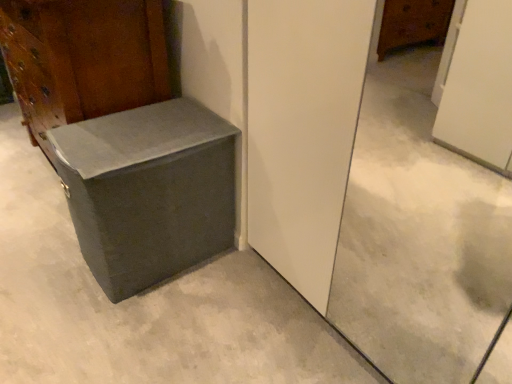
Describe the element at coordinates (148, 191) in the screenshot. I see `matte gray cardboard box at lower left` at that location.

Image resolution: width=512 pixels, height=384 pixels. What do you see at coordinates (143, 305) in the screenshot? I see `gray concrete at center` at bounding box center [143, 305].

Identify the location of matte gray cardboard box at lower left. tap(148, 191).

From a real-world perspective, relative to gray concrete at center, is matte gray cardboard box at lower left vertically above or below?

matte gray cardboard box at lower left is situated higher than gray concrete at center in the real world.

Considering the relative positions of matte gray cardboard box at lower left and gray concrete at center in the image provided, is matte gray cardboard box at lower left to the right of gray concrete at center from the viewer's perspective?

Correct, you'll find matte gray cardboard box at lower left to the right of gray concrete at center.

From the image's perspective, is matte gray cardboard box at lower left under gray concrete at center?

No, from the image's perspective, matte gray cardboard box at lower left is not beneath gray concrete at center.

Is matte gray cardboard box at lower left situated inside gray concrete at center or outside?

matte gray cardboard box at lower left cannot be found inside gray concrete at center.

The image size is (512, 384). I want to click on furniture that appears above the matte gray cardboard box at lower left (from a real-world perspective), so click(x=83, y=59).

What's the angular difference between matte gray trunk at lower left and matte gray cardboard box at lower left's facing directions?

There is a 0.226-degree angle between the facing directions of matte gray trunk at lower left and matte gray cardboard box at lower left.

Is matte gray trunk at lower left closer to the viewer compared to matte gray cardboard box at lower left?

No.

Could you tell me if matte gray trunk at lower left is facing gray concrete at center?

No, matte gray trunk at lower left is not facing towards gray concrete at center.

In terms of height, does matte gray trunk at lower left look taller or shorter compared to gray concrete at center?

In the image, matte gray trunk at lower left appears to be taller than gray concrete at center.

Is matte gray trunk at lower left surrounding gray concrete at center?

Definitely not — gray concrete at center is not inside matte gray trunk at lower left.

Which is nearer, (19,104) or (18,125)?

The point (18,125) is in front.

The image size is (512, 384). Find the location of `furniture above the matte gray cardboard box at lower left (from the image's perspective)`. furniture above the matte gray cardboard box at lower left (from the image's perspective) is located at coordinates (83, 59).

Between matte gray cardboard box at lower left and matte gray trunk at lower left, which one has smaller size?

matte gray cardboard box at lower left.

Which object is positioned more to the right, matte gray cardboard box at lower left or matte gray trunk at lower left?

Positioned to the right is matte gray cardboard box at lower left.

Is matte gray trunk at lower left surrounded by matte gray cardboard box at lower left?

No, matte gray cardboard box at lower left does not contain matte gray trunk at lower left.

Which object is wider, gray concrete at center or matte gray trunk at lower left?

Wider between the two is gray concrete at center.

What's the angular difference between gray concrete at center and matte gray trunk at lower left's facing directions?

They differ by 90.2 degrees in their facing directions.

The height and width of the screenshot is (384, 512). Identify the location of furniture on the right of gray concrete at center. (83, 59).

From the image's perspective, is gray concrete at center over matte gray cardboard box at lower left?

No, from the image's perspective, gray concrete at center is not over matte gray cardboard box at lower left.

Is gray concrete at center facing away from matte gray cardboard box at lower left?

gray concrete at center does not have its back to matte gray cardboard box at lower left.

Is gray concrete at center taller than matte gray cardboard box at lower left?

No, gray concrete at center is not taller than matte gray cardboard box at lower left.

How different are the orientations of gray concrete at center and matte gray cardboard box at lower left in degrees?

The angle between the facing direction of gray concrete at center and the facing direction of matte gray cardboard box at lower left is 90 degrees.

Identify the location of concrete in front of the matte gray cardboard box at lower left. This screenshot has height=384, width=512. (143, 305).

Locate an element on the screen. The height and width of the screenshot is (384, 512). furniture above the matte gray cardboard box at lower left (from a real-world perspective) is located at coordinates (83, 59).

Based on the photo, estimate the real-world distances between objects in this image. Which object is closer to gray concrete at center, matte gray cardboard box at lower left or matte gray trunk at lower left?

matte gray cardboard box at lower left.

Considering their positions, is matte gray trunk at lower left positioned closer to gray concrete at center than matte gray cardboard box at lower left?

Among the two, matte gray cardboard box at lower left is located nearer to gray concrete at center.

When comparing their distances from matte gray trunk at lower left, does gray concrete at center or matte gray cardboard box at lower left seem closer?

matte gray cardboard box at lower left.

Which object lies nearer to the anchor point matte gray trunk at lower left, matte gray cardboard box at lower left or gray concrete at center?

matte gray cardboard box at lower left is positioned closer to the anchor matte gray trunk at lower left.

Which object lies further to the anchor point matte gray cardboard box at lower left, gray concrete at center or matte gray trunk at lower left?

matte gray trunk at lower left.

Based on their spatial positions, is matte gray trunk at lower left or gray concrete at center closer to matte gray cardboard box at lower left?

gray concrete at center is closer to matte gray cardboard box at lower left.

Identify the location of cardboard box between matte gray trunk at lower left and gray concrete at center in the up-down direction. (148, 191).